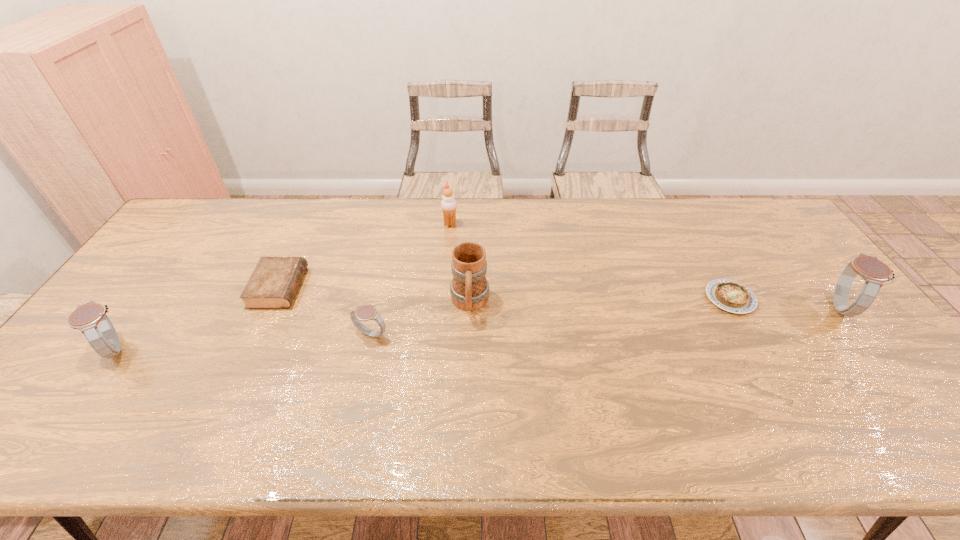
At what (x,y) coordinates should I click in order to perform the action: click on blank space that satisfies the following two spatial constraints: 1. on the back side of the fourth tallest object; 2. on the right side of the rightmost object. Please return your answer as a coordinate pair (x, y). The width and height of the screenshot is (960, 540). Looking at the image, I should click on (146, 307).